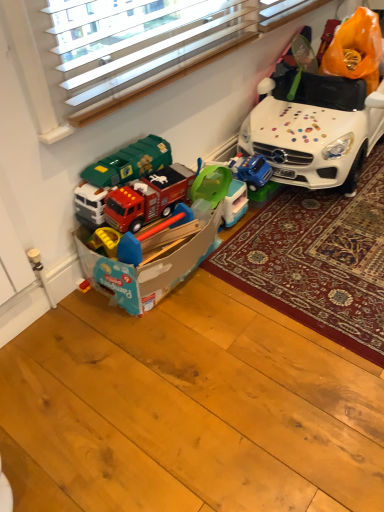
The height and width of the screenshot is (512, 384). Identify the location of vacant area that is in front of matte plastic toy box at lower left, marked as the 1th toy in a front-to-back arrangement. (148, 351).